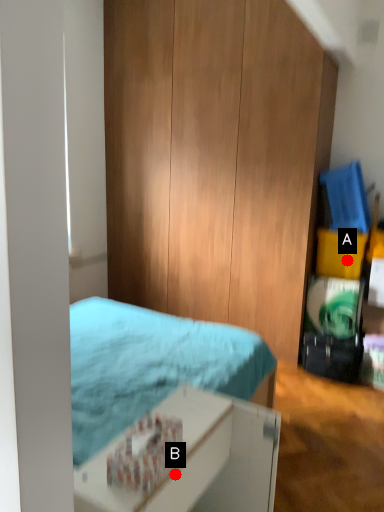
Question: Two points are circled on the image, labeled by A and B beside each circle. Which of the following is the farthest from the observer?

Choices:
 (A) A is further
 (B) B is further

Answer: (A)